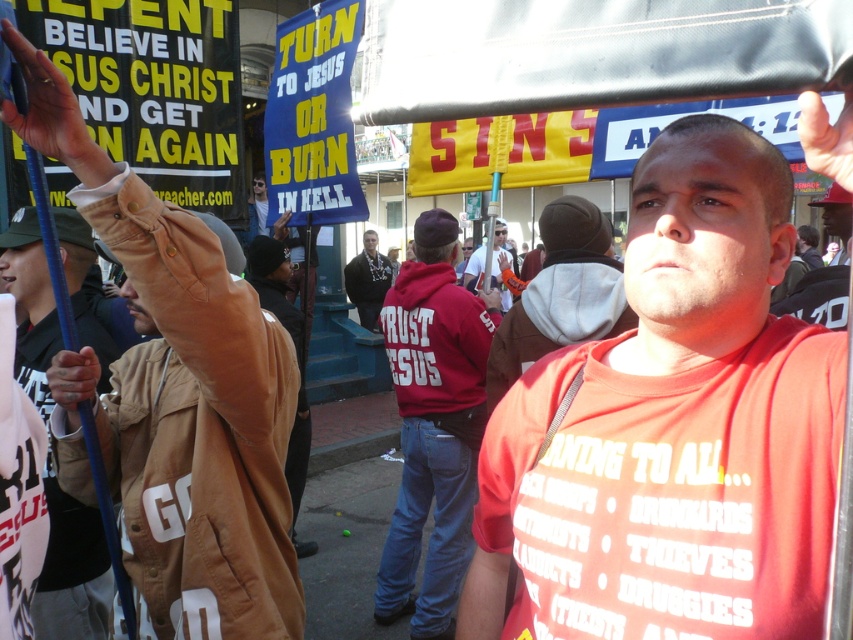
Question: Estimate the real-world distances between objects in this image. Which object is farther from the brown leather jacket at left?

Choices:
 (A) brown suede jacket at center
 (B) matte black sunglasses at upper left
 (C) matte white shirt at center
 (D) brown leather jacket at upper left

Answer: (C)

Question: From the image, what is the correct spatial relationship of matte red t-shirt at center in relation to dark gray hoodie at center?

Choices:
 (A) left
 (B) right

Answer: (B)

Question: Considering the relative positions of brown suede jacket at center and dark gray hoodie at center in the image provided, where is brown suede jacket at center located with respect to dark gray hoodie at center?

Choices:
 (A) above
 (B) below

Answer: (B)

Question: Among these objects, which one is farthest from the camera?

Choices:
 (A) matte white shirt at center
 (B) brown suede jacket at center
 (C) dark gray hoodie at center

Answer: (A)

Question: Which point appears farthest from the camera in this image?

Choices:
 (A) (492, 241)
 (B) (579, 300)
 (C) (421, 484)

Answer: (A)

Question: Can you confirm if brown leather jacket at upper left is positioned above matte black sunglasses at upper left?

Choices:
 (A) no
 (B) yes

Answer: (A)